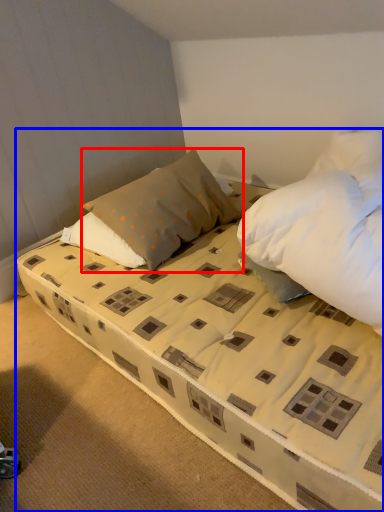
Question: Among these objects, which one is farthest to the camera, pillow (highlighted by a red box) or bed (highlighted by a blue box)?

Choices:
 (A) pillow
 (B) bed

Answer: (A)